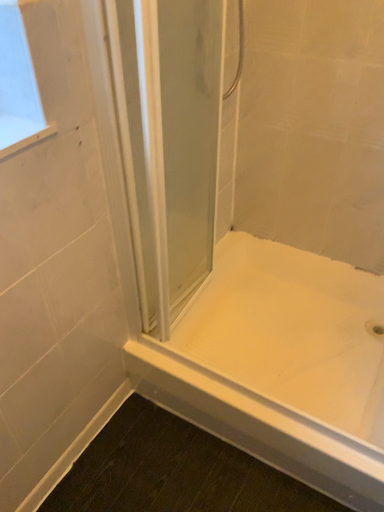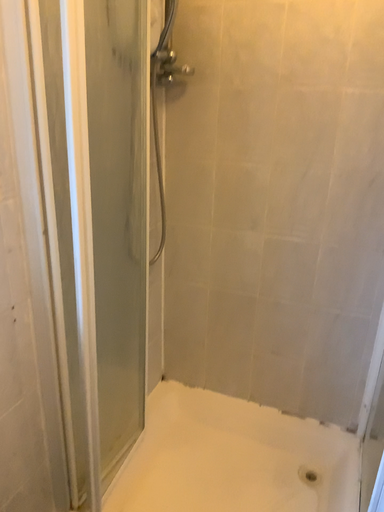
Question: How did the camera likely rotate when shooting the video?

Choices:
 (A) rotated downward
 (B) rotated upward

Answer: (B)